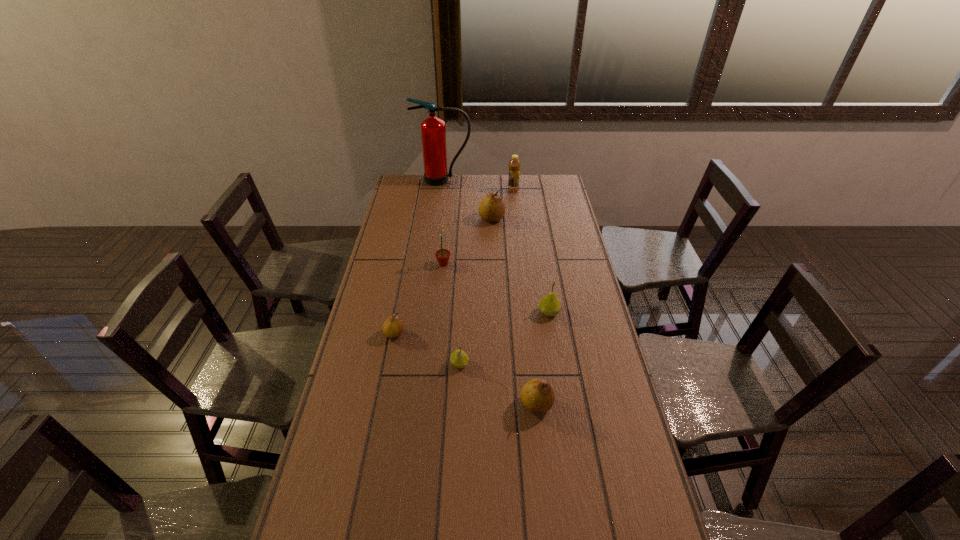
Identify which object is the fifth closest to the tallest object. Please provide its 2D coordinates. Your answer should be formatted as a tuple, i.e. [(x, y)], where the tuple contains the x and y coordinates of a point satisfying the conditions above.

[(393, 327)]

Identify which pear is the second closest to the third nearest pear. Please provide its 2D coordinates. Your answer should be formatted as a tuple, i.e. [(x, y)], where the tuple contains the x and y coordinates of a point satisfying the conditions above.

[(537, 395)]

Identify the location of the second closest pear to the left green pear. The image size is (960, 540). (393, 327).

Select which brown pear appears as the third closest to the seventh nearest object. Please provide its 2D coordinates. Your answer should be formatted as a tuple, i.e. [(x, y)], where the tuple contains the x and y coordinates of a point satisfying the conditions above.

[(537, 395)]

Find the location of a particular element. The width and height of the screenshot is (960, 540). the closest brown pear to the farthest object is located at coordinates (491, 208).

This screenshot has width=960, height=540. Identify the location of free region that satisfies the following two spatial constraints: 1. on the back side of the farther green pear; 2. on the left side of the seventh farthest object. (x=462, y=312).

Find the location of a particular element. This screenshot has height=540, width=960. vacant point that satisfies the following two spatial constraints: 1. on the face of the green sunflower; 2. on the right side of the fourth nearest pear is located at coordinates (439, 312).

This screenshot has height=540, width=960. What are the coordinates of `free spot that satisfies the following two spatial constraints: 1. on the front side of the bottle; 2. on the face of the fourth farthest object` in the screenshot? It's located at (521, 264).